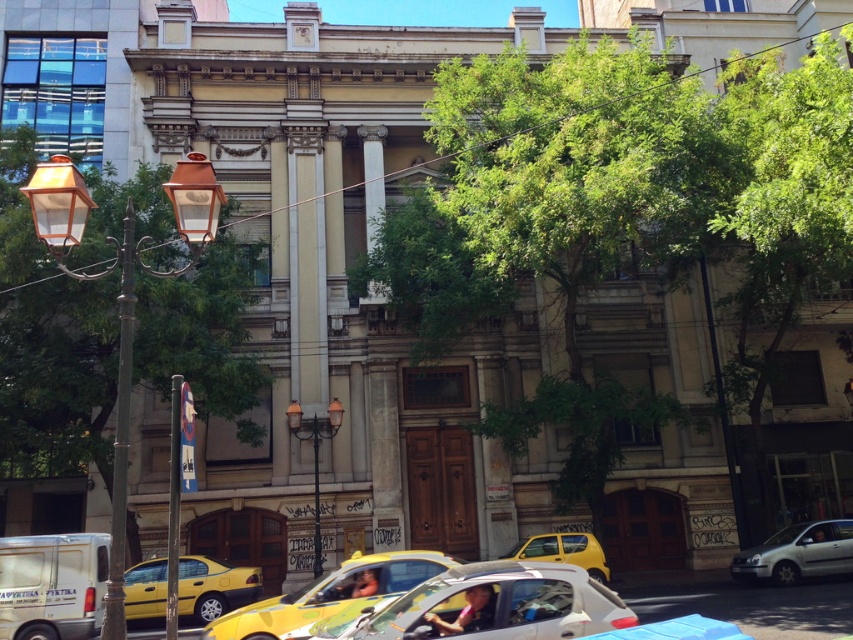
You are standing at the point labeled as point (51, 586) in the image, which is near the white matte van at lower left. You want to walk to the yellow taxi. Which direction should you go relative to the white matte van at lower left?

The point (51, 586) is near the white matte van at lower left. To reach the yellow taxi, you should walk towards the right side of the white matte van at lower left.

You are a pedestrian standing on the sidewalk in front of the classical building. You see two yellow taxis at center. Which one is closer to you, the yellow glossy taxi at center or the yellow matte taxi at center?

The yellow glossy taxi at center is closer to you because it is in front of the yellow matte taxi at center.